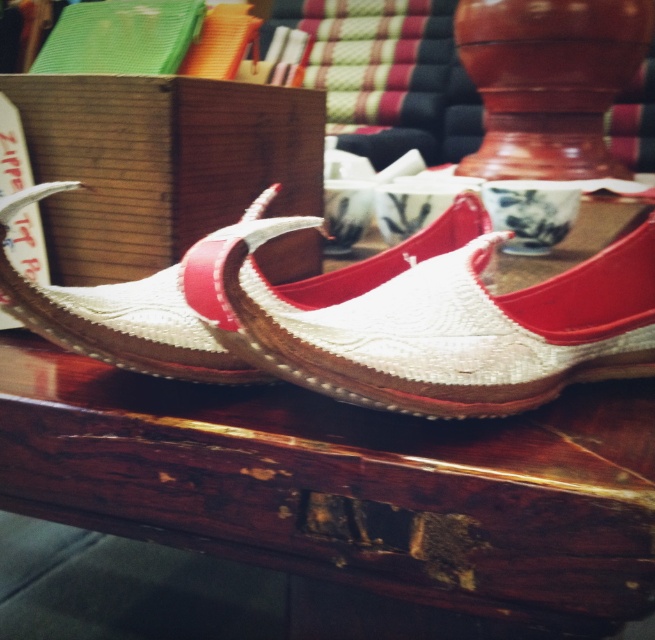
Question: Which of the following is the closest to the observer?

Choices:
 (A) (84, 428)
 (B) (468, 317)

Answer: (B)

Question: Estimate the real-world distances between objects in this image. Which object is farther from the wooden table at center?

Choices:
 (A) woven fabric sandal at center
 (B) white woven sandal at center

Answer: (A)

Question: Which is farther from the wooden table at center?

Choices:
 (A) woven fabric sandal at center
 (B) white woven sandal at center

Answer: (A)

Question: Is wooden table at center smaller than white woven sandal at center?

Choices:
 (A) yes
 (B) no

Answer: (B)

Question: Is wooden table at center positioned behind woven fabric sandal at center?

Choices:
 (A) yes
 (B) no

Answer: (A)

Question: Is white woven sandal at center positioned behind woven fabric sandal at center?

Choices:
 (A) yes
 (B) no

Answer: (B)